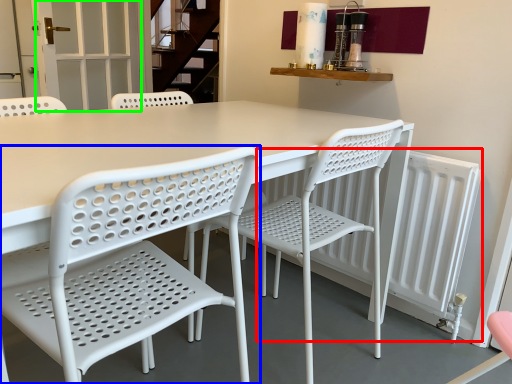
Question: Which object is positioned closest to radiator (highlighted by a red box)? Select from chair (highlighted by a blue box) and screen door (highlighted by a green box).

Choices:
 (A) chair
 (B) screen door

Answer: (A)